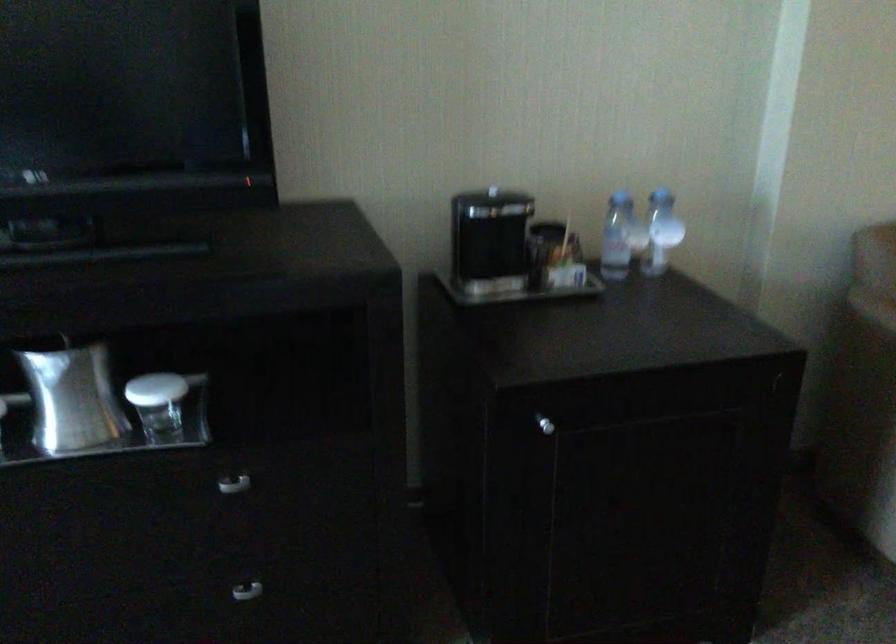
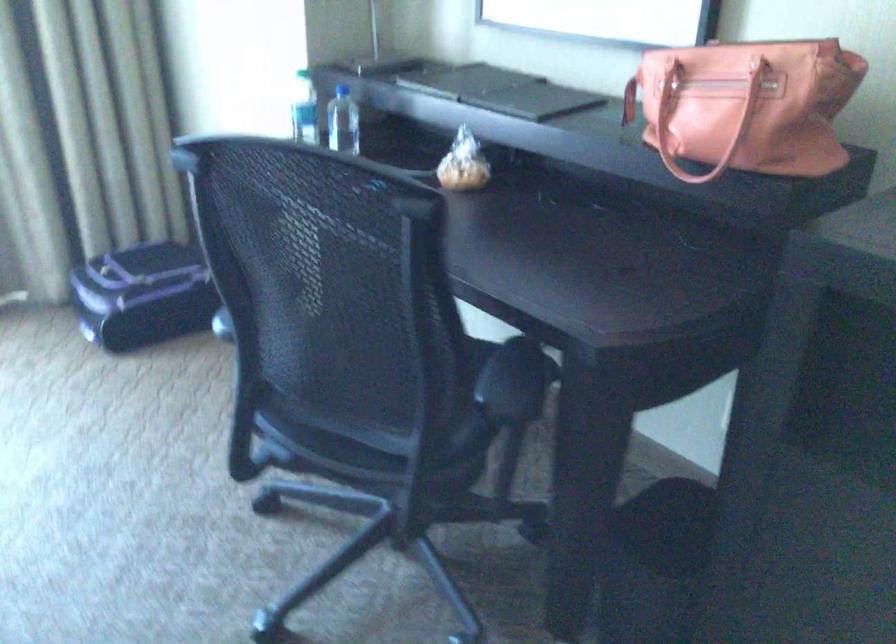
Question: The camera is either moving clockwise (left) or counter-clockwise (right) around the object. The first image is from the beginning of the video and the second image is from the end. Is the camera moving left or right when shooting the video?

Choices:
 (A) Left
 (B) Right

Answer: (B)